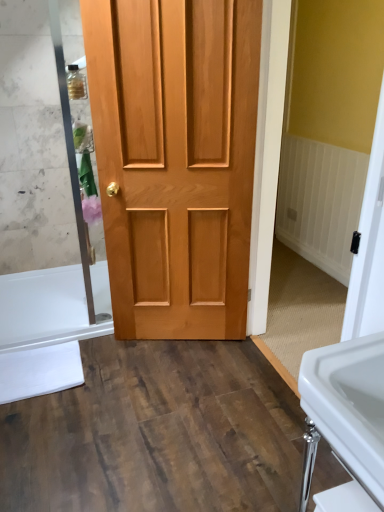
Question: Considering the positions of point (82, 314) and point (125, 67), is point (82, 314) closer or farther from the camera than point (125, 67)?

Choices:
 (A) farther
 (B) closer

Answer: (A)

Question: Is white glossy bathtub at lower left taller or shorter than natural wood door at center?

Choices:
 (A) tall
 (B) short

Answer: (B)

Question: Estimate the real-world distances between objects in this image. Which object is closer to the white glossy sink at lower right?

Choices:
 (A) natural wood door at center
 (B) white glossy bathtub at lower left

Answer: (A)

Question: Which object is positioned farthest from the white glossy sink at lower right?

Choices:
 (A) white glossy bathtub at lower left
 (B) natural wood door at center

Answer: (A)